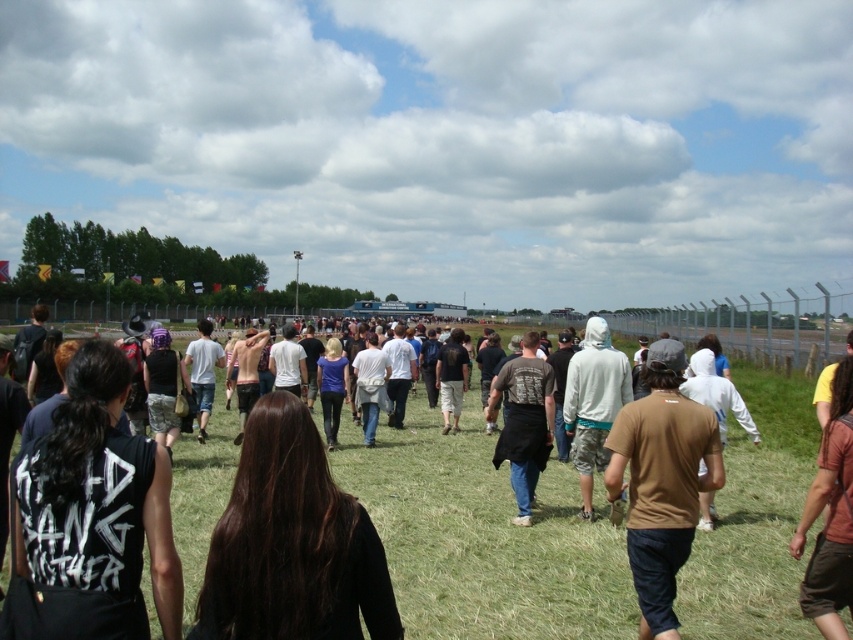
Does white cotton shirt at center appear on the right side of dark brown leather jacket at center?

In fact, white cotton shirt at center is to the left of dark brown leather jacket at center.

Describe the element at coordinates (202, 371) in the screenshot. I see `white cotton shirt at center` at that location.

Identify the location of white cotton shirt at center. This screenshot has width=853, height=640. (202, 371).

Can you confirm if black fabric shirt at center is positioned to the left of dark brown hair at center?

Indeed, black fabric shirt at center is positioned on the left side of dark brown hair at center.

Is point (61, 432) positioned in front of point (251, 499)?

No, (61, 432) is behind (251, 499).

I want to click on black fabric shirt at center, so click(93, 515).

Is brown cotton t-shirt at right shorter than black fabric jacket at center?

Correct, brown cotton t-shirt at right is not as tall as black fabric jacket at center.

Where is `brown cotton t-shirt at right`? The image size is (853, 640). brown cotton t-shirt at right is located at coordinates (660, 481).

Which is behind, point (653, 360) or point (521, 426)?

Positioned behind is point (521, 426).

Locate an element on the screen. This screenshot has height=640, width=853. brown cotton t-shirt at right is located at coordinates (660, 481).